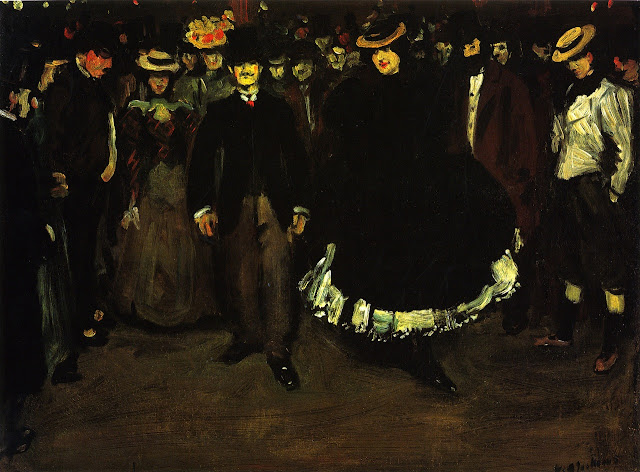
Identify the location of empty floor on left of painting. This screenshot has width=640, height=472. click(154, 409).